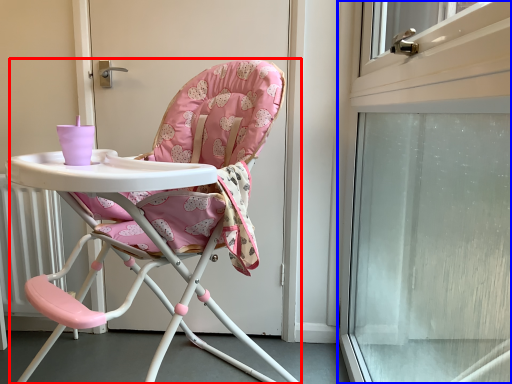
Question: Which object appears farthest to the camera in this image, chair (highlighted by a red box) or screen door (highlighted by a blue box)?

Choices:
 (A) chair
 (B) screen door

Answer: (A)